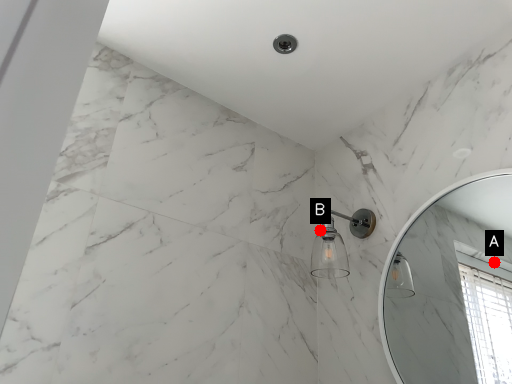
Question: Two points are circled on the image, labeled by A and B beside each circle. Which of the following is the farthest from the observer?

Choices:
 (A) A is further
 (B) B is further

Answer: (A)